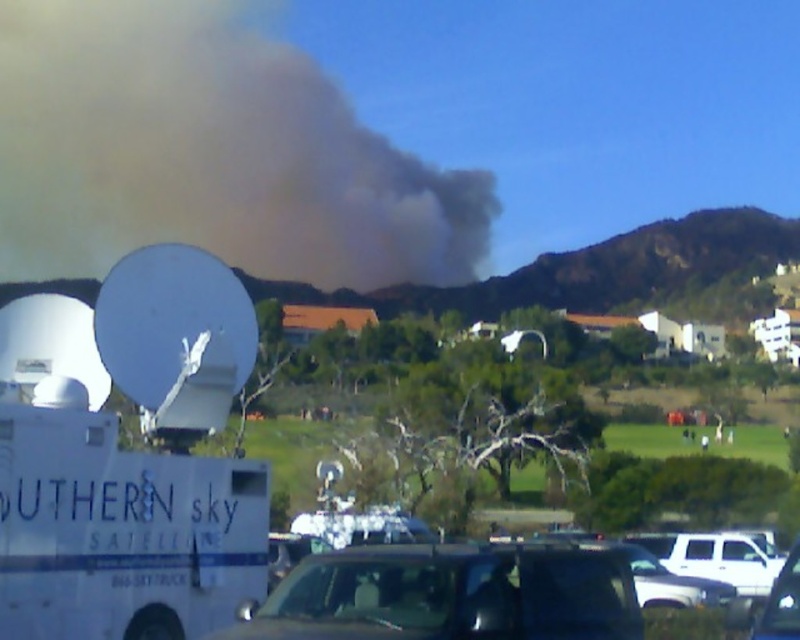
Can you confirm if white matte suv at lower right is bigger than metallic silver car at center?

Yes, white matte suv at lower right is bigger than metallic silver car at center.

Is the position of white matte suv at lower right less distant than that of metallic silver car at center?

No, white matte suv at lower right is behind metallic silver car at center.

Is point (720, 579) behind point (796, 557)?

That is True.

The image size is (800, 640). I want to click on white matte suv at lower right, so click(716, 557).

Which is in front, point (482, 589) or point (794, 580)?

Positioned in front is point (482, 589).

Is point (496, 566) less distant than point (788, 627)?

No, (496, 566) is further to viewer.

Is point (605, 605) positioned before point (778, 579)?

No, (605, 605) is behind (778, 579).

This screenshot has width=800, height=640. Identify the location of black glossy car at center. (450, 595).

Can you confirm if black glossy car at center is positioned above white matte suv at lower right?

Indeed, black glossy car at center is positioned over white matte suv at lower right.

Describe the element at coordinates (450, 595) in the screenshot. I see `black glossy car at center` at that location.

What are the coordinates of `black glossy car at center` in the screenshot? It's located at (450, 595).